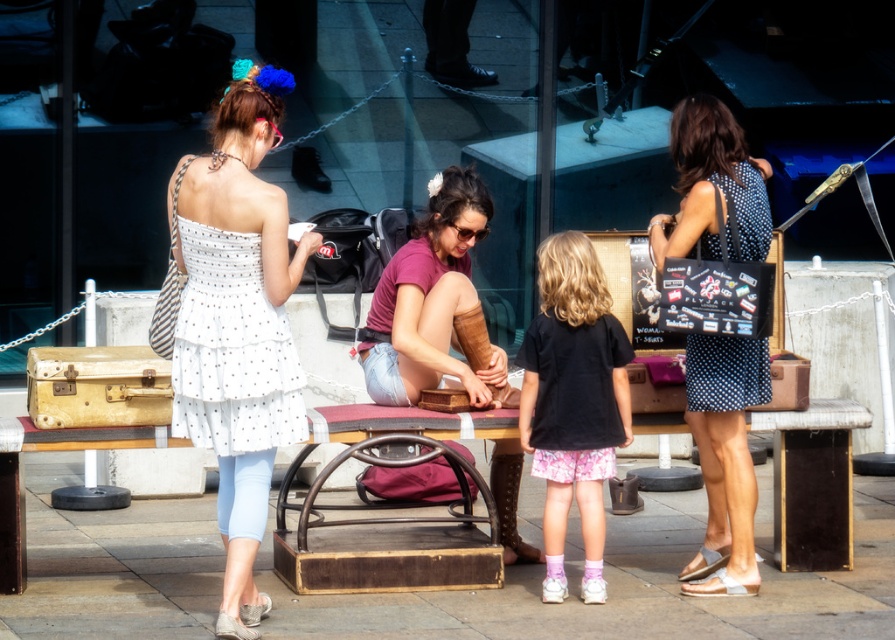
You are a photographer trying to capture a shot of the polka dot dress at right and the brown leather boots at center. Based on their positions, which object is located to the right of the other?

The polka dot dress at right is positioned on the right side of the brown leather boots at center.